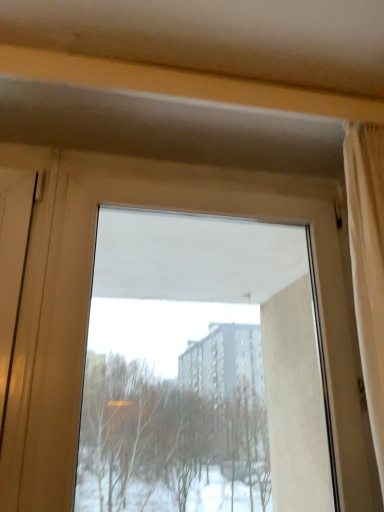
The height and width of the screenshot is (512, 384). What do you see at coordinates (202, 369) in the screenshot? I see `transparent plastic window screen at center` at bounding box center [202, 369].

You are a GUI agent. You are given a task and a screenshot of the screen. Output one action in this format:
    pyautogui.click(x=<x>, y=<y>)
    Task: Click on the transparent plastic window screen at center
    The image size is (384, 512).
    Given the screenshot: What is the action you would take?
    pyautogui.click(x=202, y=369)

The width and height of the screenshot is (384, 512). What are the coordinates of `transparent plastic window screen at center` in the screenshot? It's located at (202, 369).